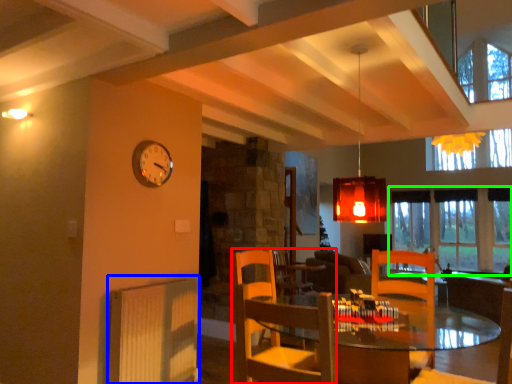
Question: Considering the real-world distances, which object is farthest from chair (highlighted by a red box)? radiator (highlighted by a blue box) or window (highlighted by a green box)?

Choices:
 (A) radiator
 (B) window

Answer: (B)